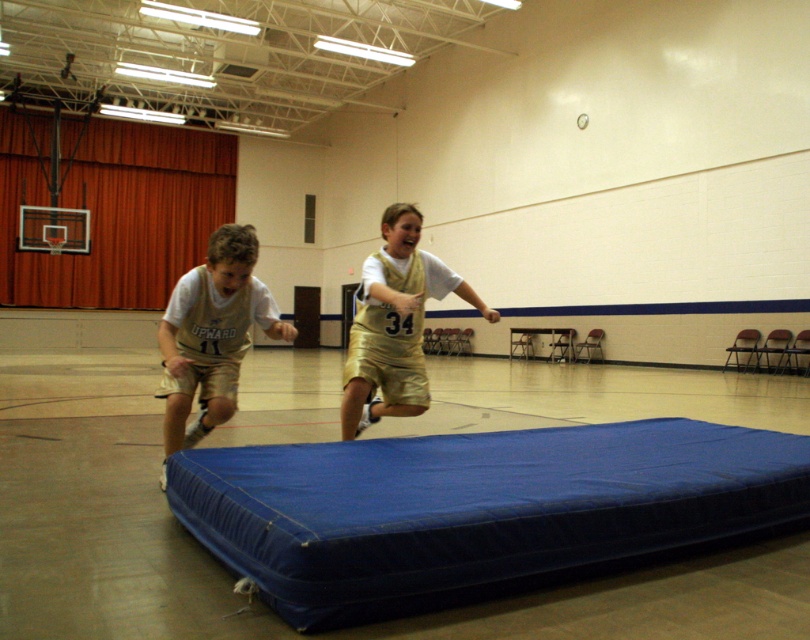
You are a coach in the gym and want to place a new equipment box at position point 0.8, 0.6. Is there enough space to place it there without overlapping the blue fabric mattress at center?

The blue fabric mattress at center is located at point (x=480, y=509), so placing the equipment box at (x=486, y=512) would be very close but might overlap slightly depending on the size of the mattress and box. Check the dimensions before placing.

You are a photographer setting up for a sports event. You need to position a camera so that both the gold metallic shorts at left and the gold metallic shorts at center are visible in the frame. Which pair of shorts should you focus on to ensure they both fit in the shot?

The gold metallic shorts at left occupies less space than the gold metallic shorts at center, so focusing on the gold metallic shorts at center would ensure both are visible as it takes up more space, allowing the smaller one to fit within the frame.

You are a parent trying to decide if the gold metallic shorts at center can be placed on the blue fabric mattress at center without overlapping the edges. Based on their widths, will they fit?

The blue fabric mattress at center is wider than the gold metallic shorts at center, so yes, the shorts can be placed on the mattress without overlapping the edges.